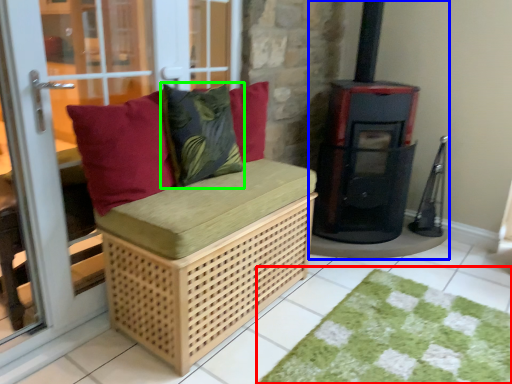
Question: Which object is the closest to the doormat (highlighted by a red box)? Choose among these: wood burning stove (highlighted by a blue box) or throw pillow (highlighted by a green box).

Choices:
 (A) wood burning stove
 (B) throw pillow

Answer: (A)